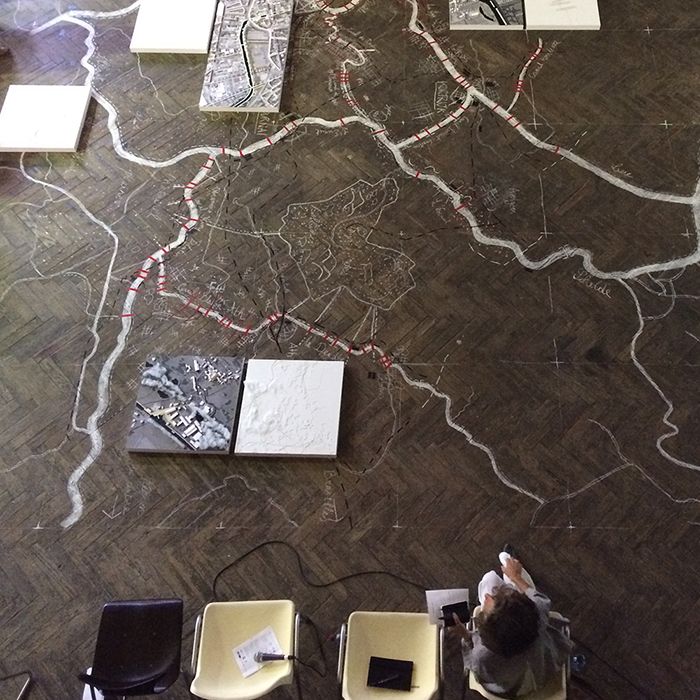
Identify the location of book. [379, 672], [448, 608].